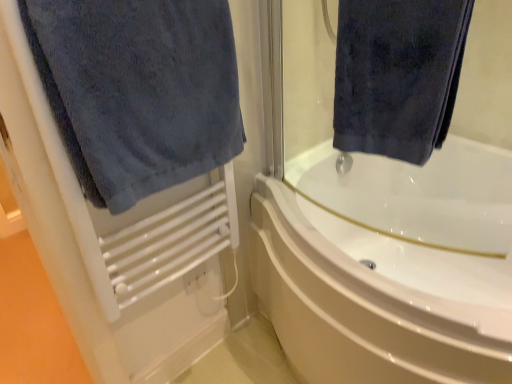
What is the approximate width of dark blue towel at left, which is counted as the 1th towel, starting from the left?

5.37 inches.

The image size is (512, 384). Find the location of `dark blue velvety towel at upper right, the second towel in the left-to-right sequence`. dark blue velvety towel at upper right, the second towel in the left-to-right sequence is located at coordinates (397, 75).

At what (x,y) coordinates should I click in order to perform the action: click on dark blue towel at left, which is counted as the 1th towel, starting from the left. Please return your answer as a coordinate pair (x, y). This screenshot has height=384, width=512. Looking at the image, I should click on (138, 90).

Is white glossy bathtub at center completely or partially outside of dark blue velvety towel at upper right, the second towel in the left-to-right sequence?

Yes, white glossy bathtub at center is located beyond the bounds of dark blue velvety towel at upper right, the second towel in the left-to-right sequence.

Is white glossy bathtub at center looking in the opposite direction of dark blue velvety towel at upper right, the first towel in the right-to-left sequence?

white glossy bathtub at center does not have its back to dark blue velvety towel at upper right, the first towel in the right-to-left sequence.

Between white glossy bathtub at center and dark blue velvety towel at upper right, the first towel in the right-to-left sequence, which one has more height?

white glossy bathtub at center.

Can you confirm if white glossy bathtub at center is positioned to the left of dark blue velvety towel at upper right, the second towel in the left-to-right sequence?

No.

Is point (110, 67) in front of point (270, 236)?

Yes, it is.

Is dark blue towel at left, which is counted as the 1th towel, starting from the left, aimed at white glossy bathtub at center?

No, dark blue towel at left, which is counted as the 1th towel, starting from the left, is not oriented towards white glossy bathtub at center.

From a real-world perspective, is dark blue towel at left, arranged as the 2th towel when viewed from the right, physically below white glossy bathtub at center?

No, from a real-world perspective, dark blue towel at left, arranged as the 2th towel when viewed from the right, is not beneath white glossy bathtub at center.

Which object is thinner, dark blue towel at left, arranged as the 2th towel when viewed from the right, or white glossy bathtub at center?

With smaller width is dark blue towel at left, arranged as the 2th towel when viewed from the right.

From a real-world perspective, does dark blue velvety towel at upper right, the second towel in the left-to-right sequence, sit lower than dark blue towel at left, arranged as the 2th towel when viewed from the right?

Incorrect, from a real-world perspective, dark blue velvety towel at upper right, the second towel in the left-to-right sequence, is higher than dark blue towel at left, arranged as the 2th towel when viewed from the right.

Which of these two, dark blue velvety towel at upper right, the first towel in the right-to-left sequence, or dark blue towel at left, arranged as the 2th towel when viewed from the right, is wider?

With larger width is dark blue towel at left, arranged as the 2th towel when viewed from the right.

How distant is dark blue velvety towel at upper right, the first towel in the right-to-left sequence, from dark blue towel at left, arranged as the 2th towel when viewed from the right?

dark blue velvety towel at upper right, the first towel in the right-to-left sequence, and dark blue towel at left, arranged as the 2th towel when viewed from the right, are 15.26 inches apart from each other.

Is point (407, 78) closer or farther from the camera than point (146, 110)?

Point (407, 78).

Is white glossy bathtub at center not close to dark blue towel at left, which is counted as the 1th towel, starting from the left?

white glossy bathtub at center is near dark blue towel at left, which is counted as the 1th towel, starting from the left, not far away.

From a real-world perspective, which is physically above, white glossy bathtub at center or dark blue towel at left, which is counted as the 1th towel, starting from the left?

dark blue towel at left, which is counted as the 1th towel, starting from the left.

Measure the distance between white glossy bathtub at center and dark blue towel at left, which is counted as the 1th towel, starting from the left.

They are 20.61 inches apart.

Is the position of white glossy bathtub at center less distant than that of dark blue towel at left, which is counted as the 1th towel, starting from the left?

No, white glossy bathtub at center is further to the viewer.

Which point is more forward, [402,86] or [336,281]?

The point [402,86] is closer.

Could you tell me if dark blue velvety towel at upper right, the first towel in the right-to-left sequence, is turned towards white glossy bathtub at center?

No, dark blue velvety towel at upper right, the first towel in the right-to-left sequence, is not turned towards white glossy bathtub at center.

From the picture: Considering the relative positions of dark blue velvety towel at upper right, the first towel in the right-to-left sequence, and white glossy bathtub at center in the image provided, is dark blue velvety towel at upper right, the first towel in the right-to-left sequence, to the left of white glossy bathtub at center from the viewer's perspective?

Indeed, dark blue velvety towel at upper right, the first towel in the right-to-left sequence, is positioned on the left side of white glossy bathtub at center.

Is dark blue velvety towel at upper right, the first towel in the right-to-left sequence, next to white glossy bathtub at center?

dark blue velvety towel at upper right, the first towel in the right-to-left sequence, is not next to white glossy bathtub at center, and they're not touching.

Considering the sizes of objects dark blue towel at left, arranged as the 2th towel when viewed from the right, and dark blue velvety towel at upper right, the first towel in the right-to-left sequence, in the image provided, who is taller, dark blue towel at left, arranged as the 2th towel when viewed from the right, or dark blue velvety towel at upper right, the first towel in the right-to-left sequence,?

With more height is dark blue towel at left, arranged as the 2th towel when viewed from the right.

From the image's perspective, who appears lower, dark blue towel at left, which is counted as the 1th towel, starting from the left, or dark blue velvety towel at upper right, the second towel in the left-to-right sequence?

dark blue towel at left, which is counted as the 1th towel, starting from the left.

Is dark blue towel at left, arranged as the 2th towel when viewed from the right, completely or partially outside of dark blue velvety towel at upper right, the second towel in the left-to-right sequence?

Yes.

Is dark blue towel at left, arranged as the 2th towel when viewed from the right, in front of dark blue velvety towel at upper right, the first towel in the right-to-left sequence?

Yes, dark blue towel at left, arranged as the 2th towel when viewed from the right, is closer to the camera.

Locate an element on the screen. This screenshot has height=384, width=512. the 1st towel in front of the white glossy bathtub at center is located at coordinates point(397,75).

Where is `bathtub that is under the dark blue towel at left, which is counted as the 1th towel, starting from the left (from a real-world perspective)`? Image resolution: width=512 pixels, height=384 pixels. bathtub that is under the dark blue towel at left, which is counted as the 1th towel, starting from the left (from a real-world perspective) is located at coordinates (375, 299).

Which object lies further to the anchor point dark blue towel at left, arranged as the 2th towel when viewed from the right, dark blue velvety towel at upper right, the first towel in the right-to-left sequence, or white glossy bathtub at center?

white glossy bathtub at center is positioned further to the anchor dark blue towel at left, arranged as the 2th towel when viewed from the right.

Looking at the image, which one is located closer to white glossy bathtub at center, dark blue towel at left, arranged as the 2th towel when viewed from the right, or dark blue velvety towel at upper right, the second towel in the left-to-right sequence?

dark blue velvety towel at upper right, the second towel in the left-to-right sequence, is closer to white glossy bathtub at center.

Considering their positions, is white glossy bathtub at center positioned further to dark blue towel at left, which is counted as the 1th towel, starting from the left, than dark blue velvety towel at upper right, the first towel in the right-to-left sequence?

white glossy bathtub at center lies further to dark blue towel at left, which is counted as the 1th towel, starting from the left, than the other object.

Considering their positions, is white glossy bathtub at center positioned further to dark blue velvety towel at upper right, the second towel in the left-to-right sequence, than dark blue towel at left, arranged as the 2th towel when viewed from the right?

white glossy bathtub at center is positioned further to the anchor dark blue velvety towel at upper right, the second towel in the left-to-right sequence.

In the scene shown: When comparing their distances from dark blue velvety towel at upper right, the second towel in the left-to-right sequence, does dark blue towel at left, which is counted as the 1th towel, starting from the left, or white glossy bathtub at center seem closer?

dark blue towel at left, which is counted as the 1th towel, starting from the left, is closer to dark blue velvety towel at upper right, the second towel in the left-to-right sequence.

When comparing their distances from white glossy bathtub at center, does dark blue velvety towel at upper right, the second towel in the left-to-right sequence, or dark blue towel at left, arranged as the 2th towel when viewed from the right, seem further?

dark blue towel at left, arranged as the 2th towel when viewed from the right.

You are a GUI agent. You are given a task and a screenshot of the screen. Output one action in this format:
    pyautogui.click(x=<x>, y=<y>)
    Task: Click on the towel between dark blue towel at left, arranged as the 2th towel when viewed from the right, and white glossy bathtub at center from left to right
    
    Given the screenshot: What is the action you would take?
    pyautogui.click(x=397, y=75)